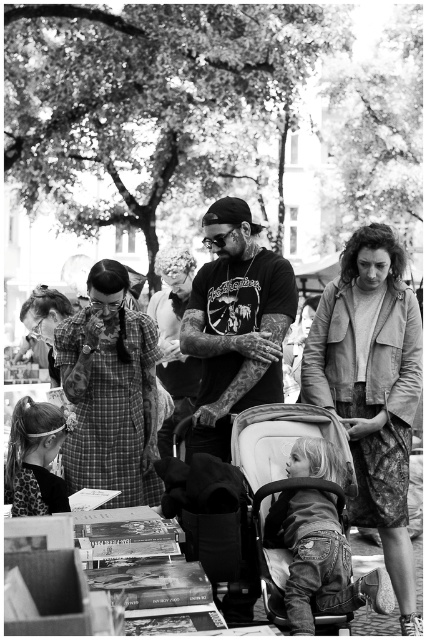
Question: Is leather jacket at center below tattooed skin at center?

Choices:
 (A) yes
 (B) no

Answer: (A)

Question: Among these points, which one is nearest to the camera?

Choices:
 (A) (161, 275)
 (B) (155, 419)

Answer: (B)

Question: Is dark skin tattooed man at center positioned in front of leather jacket at center?

Choices:
 (A) no
 (B) yes

Answer: (B)

Question: Can you confirm if white fabric baby carriage at lower center is positioned to the left of matte black shirt at center?

Choices:
 (A) yes
 (B) no

Answer: (B)

Question: Which point is closer to the camera taking this photo?

Choices:
 (A) (233, 385)
 (B) (382, 280)
 (C) (178, 250)
 (D) (386, 452)

Answer: (D)

Question: Estimate the real-world distances between objects in this image. Which object is closer to the matte black shirt at center?

Choices:
 (A) plaid fabric dress at center
 (B) tattooed skin at center

Answer: (A)